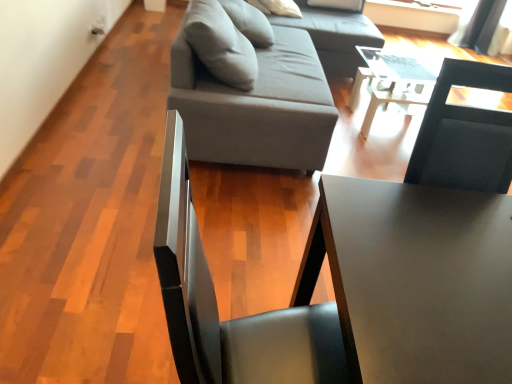
Locate an element on the screen. The width and height of the screenshot is (512, 384). matte black table at center, acting as the second table starting from the back is located at coordinates (415, 280).

Does gray fabric studio couch at upper center turn towards white glossy table at center, which is the 2th table from front to back?

Yes, gray fabric studio couch at upper center is oriented towards white glossy table at center, which is the 2th table from front to back.

Between point (298, 69) and point (381, 75), which one is positioned in front?

The point (298, 69) is more forward.

Which of these two, gray fabric studio couch at upper center or white glossy table at center, which is the 2th table from front to back, is bigger?

gray fabric studio couch at upper center is bigger.

From a real-world perspective, between gray fabric studio couch at upper center and white glossy table at center, which is the first table in top-to-bottom order, who is vertically lower?

In real-world perspective, white glossy table at center, which is the first table in top-to-bottom order, is lower.

From a real-world perspective, between gray fabric studio couch at upper center and gray fabric couch at upper center, who is vertically higher?

gray fabric studio couch at upper center is physically above.

Considering the relative sizes of gray fabric studio couch at upper center and gray fabric couch at upper center in the image provided, is gray fabric studio couch at upper center wider than gray fabric couch at upper center?

No.

Does point (301, 55) lie behind point (301, 7)?

That is False.

From the picture: How many degrees apart are the facing directions of gray fabric studio couch at upper center and gray fabric couch at upper center?

The angle between the facing direction of gray fabric studio couch at upper center and the facing direction of gray fabric couch at upper center is 0.000272 degrees.

Which of these two, matte black table at center, marked as the first table in a front-to-back arrangement, or gray fabric couch at upper center, stands shorter?

gray fabric couch at upper center is shorter.

Between matte black table at center, marked as the first table in a front-to-back arrangement, and gray fabric couch at upper center, which one has smaller width?

With smaller width is matte black table at center, marked as the first table in a front-to-back arrangement.

Considering the sizes of objects matte black table at center, marked as the first table in a front-to-back arrangement, and gray fabric couch at upper center in the image provided, who is bigger, matte black table at center, marked as the first table in a front-to-back arrangement, or gray fabric couch at upper center?

gray fabric couch at upper center.

Visually, is matte black table at center, which is the 1th table from bottom to top, positioned to the left or to the right of gray fabric couch at upper center?

matte black table at center, which is the 1th table from bottom to top, is to the right of gray fabric couch at upper center.

Consider the image. Between matte black table at center, marked as the first table in a front-to-back arrangement, and gray fabric studio couch at upper center, which one has larger size?

With larger size is gray fabric studio couch at upper center.

Consider the image. Considering the positions of objects matte black table at center, which ranks as the second table in top-to-bottom order, and gray fabric studio couch at upper center in the image provided, who is more to the left, matte black table at center, which ranks as the second table in top-to-bottom order, or gray fabric studio couch at upper center?

Positioned to the left is gray fabric studio couch at upper center.

At what (x,y) coordinates should I click in order to perform the action: click on the 1st table positioned below the gray fabric studio couch at upper center (from a real-world perspective). Please return your answer as a coordinate pair (x, y). This screenshot has width=512, height=384. Looking at the image, I should click on (415, 280).

Find the location of `table that is the 2nd object located below the gray fabric studio couch at upper center (from the image's perspective)`. table that is the 2nd object located below the gray fabric studio couch at upper center (from the image's perspective) is located at coordinates (415, 280).

Is gray fabric studio couch at upper center directly adjacent to matte black table at center, which ranks as the second table in top-to-bottom order?

There is a gap between gray fabric studio couch at upper center and matte black table at center, which ranks as the second table in top-to-bottom order.

Does gray fabric studio couch at upper center have a greater height compared to matte black table at center, acting as the second table starting from the back?

Correct, gray fabric studio couch at upper center is much taller as matte black table at center, acting as the second table starting from the back.

From a real-world perspective, which is physically below, matte black table at center, marked as the first table in a front-to-back arrangement, or white glossy table at center, which is the first table in top-to-bottom order?

In real-world perspective, white glossy table at center, which is the first table in top-to-bottom order, is lower.

Is matte black table at center, acting as the second table starting from the back, wider or thinner than white glossy table at center, which is the 2th table from front to back?

Clearly, matte black table at center, acting as the second table starting from the back, has more width compared to white glossy table at center, which is the 2th table from front to back.

Considering the positions of objects matte black table at center, marked as the first table in a front-to-back arrangement, and white glossy table at center, arranged as the first table when viewed from the back, in the image provided, who is more to the left, matte black table at center, marked as the first table in a front-to-back arrangement, or white glossy table at center, arranged as the first table when viewed from the back,?

matte black table at center, marked as the first table in a front-to-back arrangement.

Do you think matte black table at center, which ranks as the second table in top-to-bottom order, is within white glossy table at center, arranged as the first table when viewed from the back, or outside of it?

matte black table at center, which ranks as the second table in top-to-bottom order, is located beyond the bounds of white glossy table at center, arranged as the first table when viewed from the back.

Is gray fabric couch at upper center next to gray fabric studio couch at upper center and touching it?

They are not placed beside each other.

Is gray fabric couch at upper center to the left or to the right of gray fabric studio couch at upper center in the image?

In the image, gray fabric couch at upper center appears on the right side of gray fabric studio couch at upper center.

The height and width of the screenshot is (384, 512). What are the coordinates of `couch below the gray fabric studio couch at upper center (from a real-world perspective)` in the screenshot? It's located at (333, 35).

In the scene shown: Considering the positions of objects gray fabric couch at upper center and gray fabric studio couch at upper center in the image provided, who is in front, gray fabric couch at upper center or gray fabric studio couch at upper center?

Positioned in front is gray fabric studio couch at upper center.

Find the location of a particular element. This screenshot has width=512, height=384. table lying behind the gray fabric studio couch at upper center is located at coordinates (394, 79).

Find the location of `studio couch on the left side of gray fabric couch at upper center`. studio couch on the left side of gray fabric couch at upper center is located at coordinates (271, 94).

When comparing their distances from gray fabric studio couch at upper center, does matte black table at center, which is the 1th table from bottom to top, or white glossy table at center, arranged as the first table when viewed from the back, seem further?

matte black table at center, which is the 1th table from bottom to top.

Estimate the real-world distances between objects in this image. Which object is closer to gray fabric couch at upper center, matte black table at center, which is the 1th table from bottom to top, or gray fabric studio couch at upper center?

The object closer to gray fabric couch at upper center is gray fabric studio couch at upper center.

From the image, which object appears to be farther from gray fabric couch at upper center, gray fabric studio couch at upper center or white glossy table at center, which is the 2th table from front to back?

gray fabric studio couch at upper center.

When comparing their distances from white glossy table at center, which is the first table in top-to-bottom order, does gray fabric studio couch at upper center or matte black table at center, marked as the first table in a front-to-back arrangement, seem further?

The object further to white glossy table at center, which is the first table in top-to-bottom order, is matte black table at center, marked as the first table in a front-to-back arrangement.

Considering their positions, is white glossy table at center, acting as the second table starting from the bottom, positioned further to gray fabric studio couch at upper center than gray fabric couch at upper center?

white glossy table at center, acting as the second table starting from the bottom.

Considering their positions, is gray fabric studio couch at upper center positioned further to gray fabric couch at upper center than matte black table at center, which ranks as the second table in top-to-bottom order?

matte black table at center, which ranks as the second table in top-to-bottom order, is further to gray fabric couch at upper center.

Based on their spatial positions, is gray fabric couch at upper center or gray fabric studio couch at upper center further from white glossy table at center, arranged as the first table when viewed from the back?

gray fabric studio couch at upper center is further to white glossy table at center, arranged as the first table when viewed from the back.

Which object lies further to the anchor point white glossy table at center, which is the 2th table from front to back, matte black table at center, marked as the first table in a front-to-back arrangement, or gray fabric couch at upper center?

matte black table at center, marked as the first table in a front-to-back arrangement, lies further to white glossy table at center, which is the 2th table from front to back, than the other object.

This screenshot has width=512, height=384. What are the coordinates of `table located between gray fabric studio couch at upper center and gray fabric couch at upper center in the depth direction` in the screenshot? It's located at (394, 79).

Where is `studio couch between matte black table at center, marked as the first table in a front-to-back arrangement, and white glossy table at center, acting as the second table starting from the bottom, in the front-back direction`? The image size is (512, 384). studio couch between matte black table at center, marked as the first table in a front-to-back arrangement, and white glossy table at center, acting as the second table starting from the bottom, in the front-back direction is located at coordinates point(271,94).

In order to click on studio couch between matte black table at center, which is the 1th table from bottom to top, and gray fabric couch at upper center from front to back in this screenshot , I will do `click(271, 94)`.

The width and height of the screenshot is (512, 384). I want to click on table located between matte black table at center, which is the 1th table from bottom to top, and gray fabric couch at upper center in the depth direction, so click(x=394, y=79).